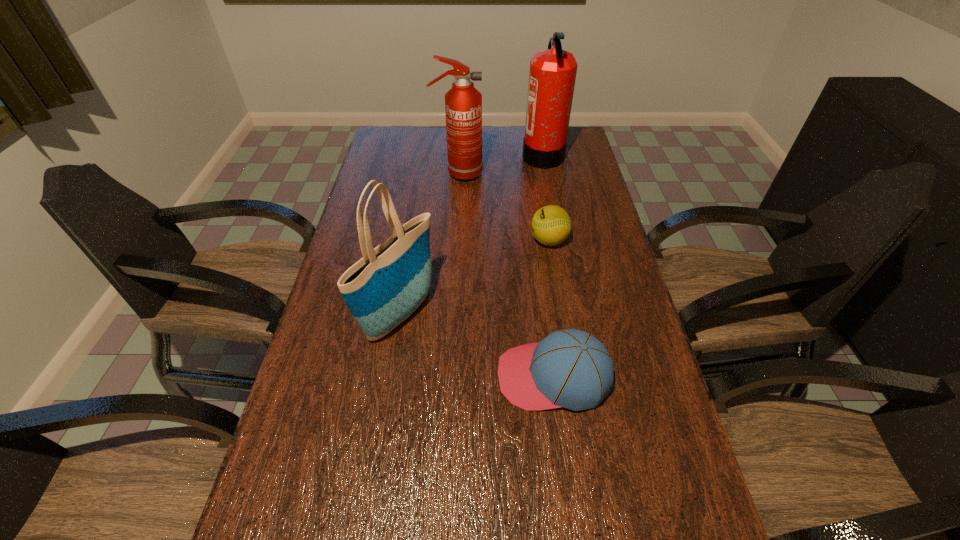
The width and height of the screenshot is (960, 540). What are the coordinates of `vacant region located on the front-facing side of the baseball cap` in the screenshot? It's located at (403, 376).

Locate an element on the screen. free location located on the front-facing side of the baseball cap is located at coordinates (454, 376).

Where is `free location located on the front-facing side of the baseball cap`? The image size is (960, 540). free location located on the front-facing side of the baseball cap is located at coordinates (420, 376).

I want to click on vacant space situated on the logo side of the softball, so click(x=465, y=240).

This screenshot has width=960, height=540. Identify the location of free region located 0.220m on the logo side of the softball. (458, 240).

Where is `blank area located on the logo side of the softball`? blank area located on the logo side of the softball is located at coordinates (420, 240).

The image size is (960, 540). Find the location of `object present at the far edge`. object present at the far edge is located at coordinates (552, 75).

The height and width of the screenshot is (540, 960). I want to click on object located at the left edge, so click(381, 290).

This screenshot has height=540, width=960. In order to click on fire extinguisher present at the right edge in this screenshot , I will do `click(552, 75)`.

The height and width of the screenshot is (540, 960). What are the coordinates of `baseball cap located in the right edge section of the desktop` in the screenshot? It's located at (569, 368).